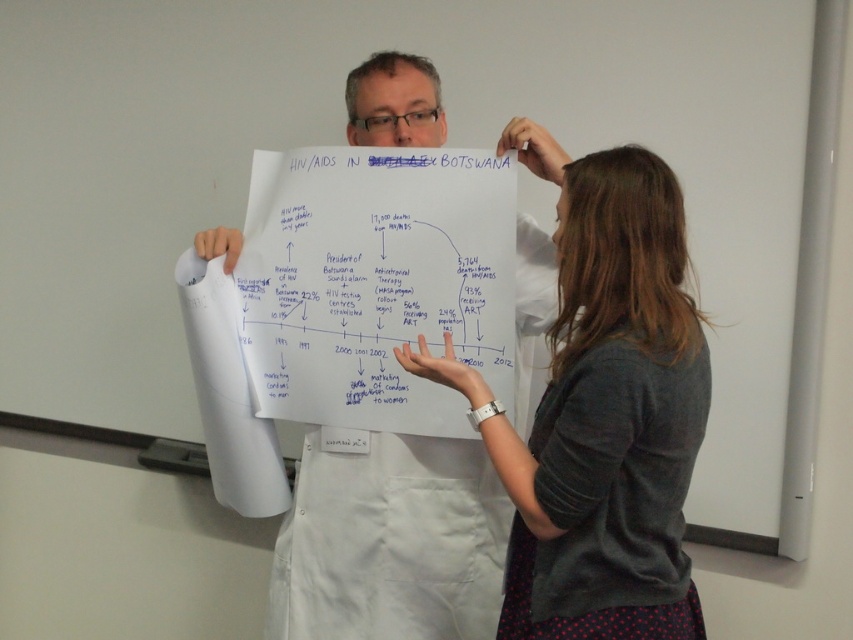
Question: Which point is farther to the camera?

Choices:
 (A) white paper at center
 (B) gray cotton shirt at center

Answer: (A)

Question: Is gray cotton shirt at center positioned in front of white paper at center?

Choices:
 (A) yes
 (B) no

Answer: (A)

Question: Does gray cotton shirt at center have a larger size compared to white paper at center?

Choices:
 (A) no
 (B) yes

Answer: (B)

Question: Is gray cotton shirt at center wider than white paper at center?

Choices:
 (A) yes
 (B) no

Answer: (B)

Question: Which of the following is the farthest from the observer?

Choices:
 (A) (601, 449)
 (B) (454, 490)

Answer: (B)